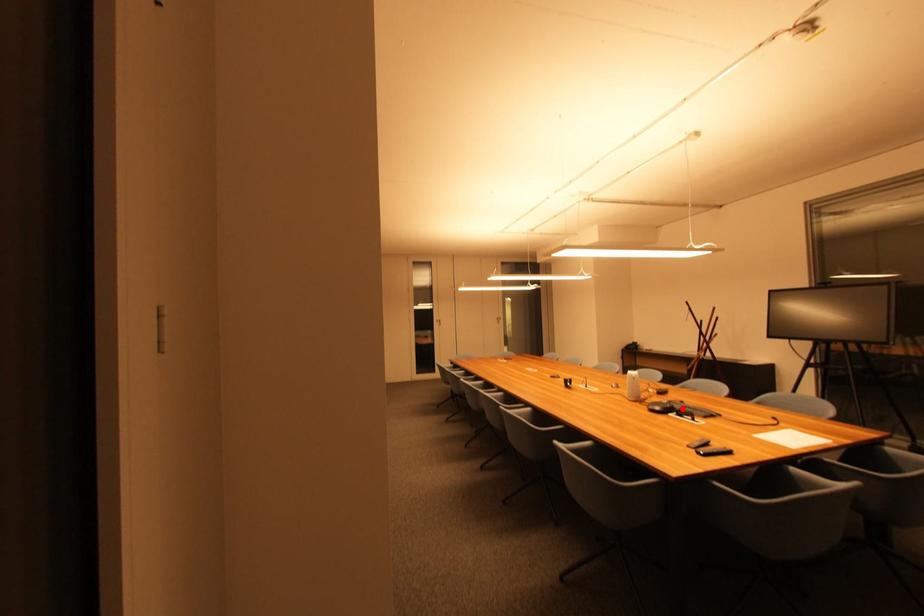
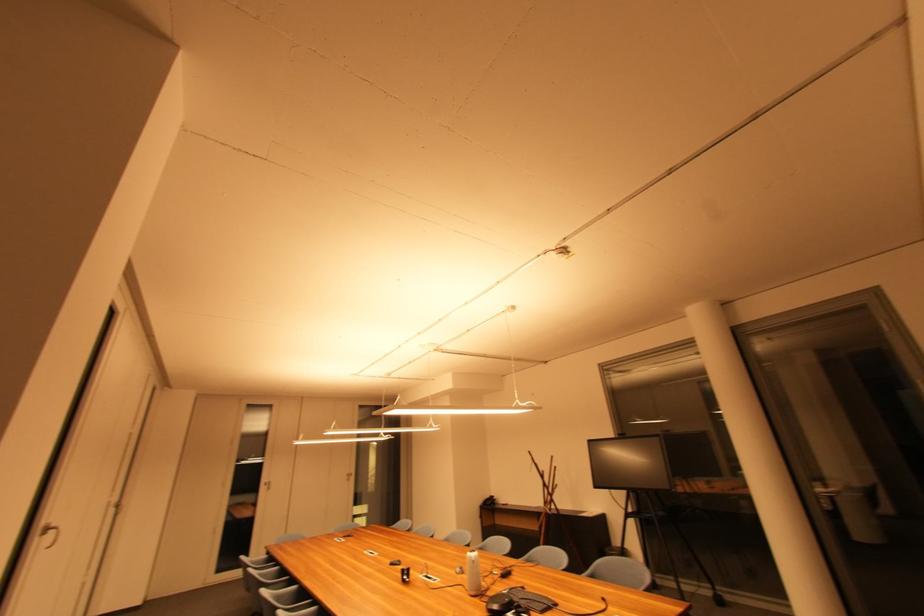
The point at the highlighted location is marked in the first image. Where is the corresponding point in the second image?

(521, 602)